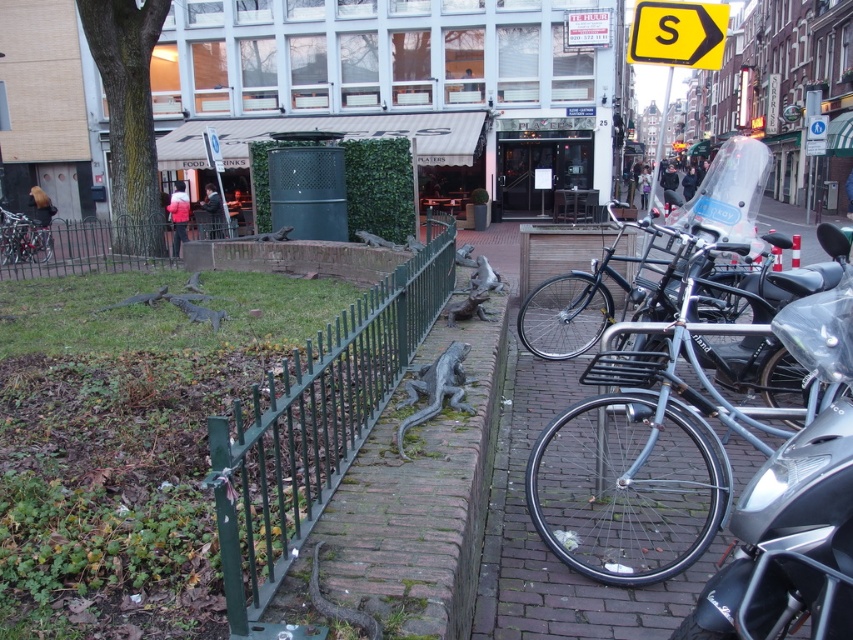
Between shiny black bicycle at right and shiny metallic bicycle at left, which one has more height?

Standing taller between the two is shiny metallic bicycle at left.

Is shiny black bicycle at right above shiny metallic bicycle at left?

Actually, shiny black bicycle at right is below shiny metallic bicycle at left.

Between point (552, 323) and point (47, 257), which one is positioned behind?

The point (47, 257) is more distant.

The width and height of the screenshot is (853, 640). Find the location of `shiny black bicycle at right`. shiny black bicycle at right is located at coordinates (585, 301).

Is point (828, 502) closer to camera compared to point (83, 259)?

Yes, point (828, 502) is closer to viewer.

Is shiny silver motorcycle at right to the left of green metal fence at left from the viewer's perspective?

No, shiny silver motorcycle at right is not to the left of green metal fence at left.

Measure the distance between point (x=784, y=310) and camera.

Point (x=784, y=310) and camera are 8.54 feet apart.

Find the location of a particular element. This screenshot has height=640, width=853. shiny silver motorcycle at right is located at coordinates (788, 541).

Measure the distance between point [258,627] and camera.

Point [258,627] and camera are 6.56 feet apart from each other.

Who is more distant from viewer, (250, 426) or (24, 234)?

Point (24, 234)

Which is behind, point (352, 416) or point (20, 214)?

The point (20, 214) is behind.

Where is `green metal fence at center`? Image resolution: width=853 pixels, height=640 pixels. green metal fence at center is located at coordinates (315, 426).